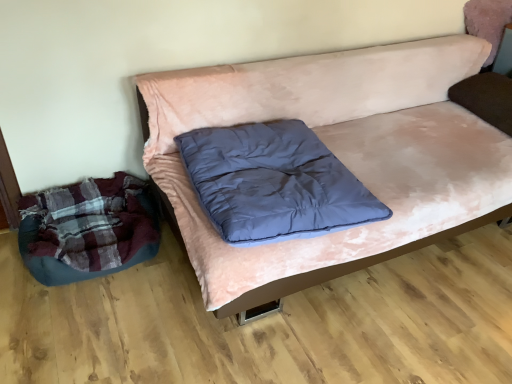
This screenshot has width=512, height=384. In order to click on vacant space to the right of plush dark blue bean bag at lower left in this screenshot , I will do `click(168, 285)`.